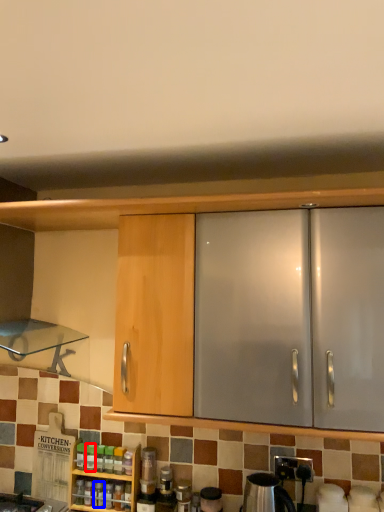
Question: Which point is further to the camera, bottle (highlighted by a red box) or bottle (highlighted by a blue box)?

Choices:
 (A) bottle
 (B) bottle

Answer: (A)